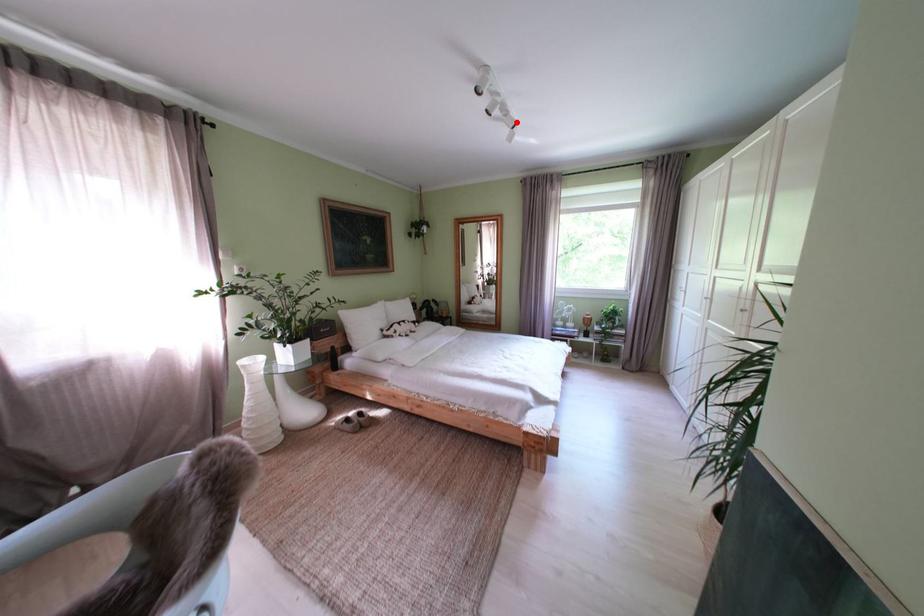
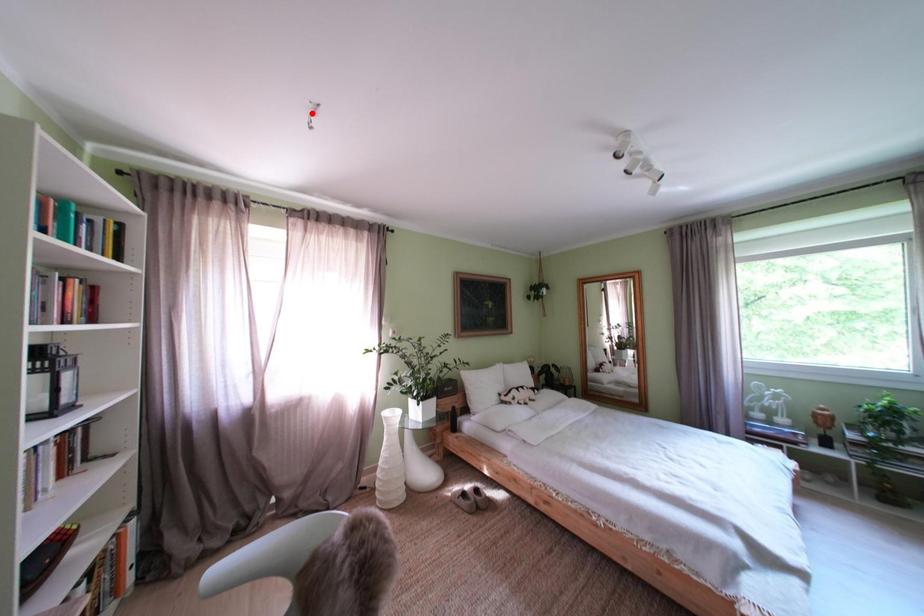
I am providing you with two images of the same scene from different viewpoints. A red point is marked on the first image and another point is marked on the second image. Do the highlighted points in image1 and image2 indicate the same real-world spot?

No